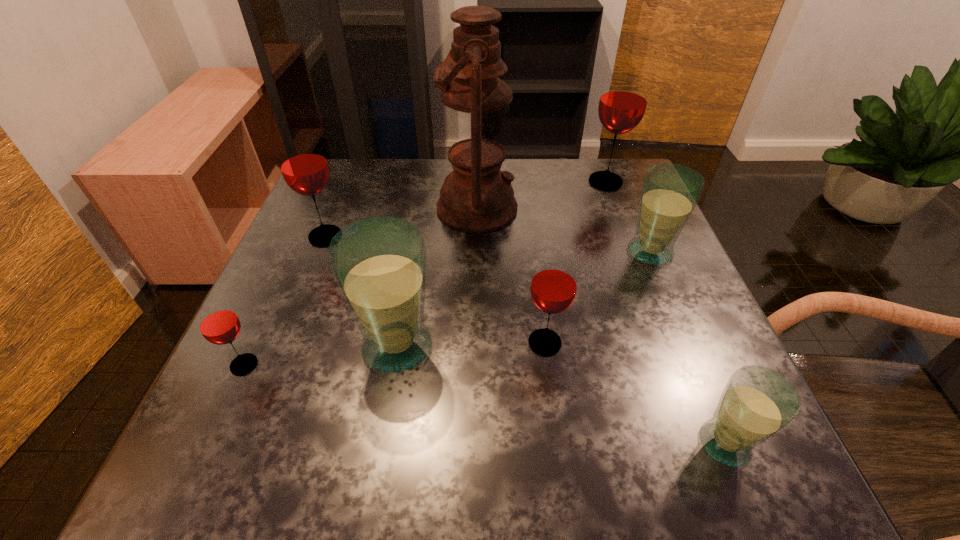
In order to click on oil lamp in this screenshot , I will do `click(476, 196)`.

You are a GUI agent. You are given a task and a screenshot of the screen. Output one action in this format:
    pyautogui.click(x=<x>, y=<y>)
    Task: Click on the biggest red glass
    The width and height of the screenshot is (960, 540).
    Given the screenshot: What is the action you would take?
    pyautogui.click(x=623, y=101)

Where is `the seventh shortest object`? the seventh shortest object is located at coordinates (623, 101).

Where is `the second farthest red glass`? the second farthest red glass is located at coordinates (303, 164).

At what (x,y) coordinates should I click in order to perform the action: click on the third glass from left to right. Please return your answer as a coordinate pair (x, y). This screenshot has width=960, height=540. Looking at the image, I should click on (379, 263).

Identify the location of the second farthest blue glass. (379, 263).

You are a GUI agent. You are given a task and a screenshot of the screen. Output one action in this format:
    pyautogui.click(x=<x>, y=<y>)
    Task: Click on the third red glass from left to right
    The width and height of the screenshot is (960, 540).
    Given the screenshot: What is the action you would take?
    pyautogui.click(x=553, y=288)

I want to click on the fourth glass from right to left, so click(553, 288).

At what (x,y) coordinates should I click in order to perform the action: click on the second biggest blue glass. Please return your answer as a coordinate pair (x, y). Looking at the image, I should click on (670, 192).

Locate an element on the screen. The height and width of the screenshot is (540, 960). the smallest red glass is located at coordinates (218, 323).